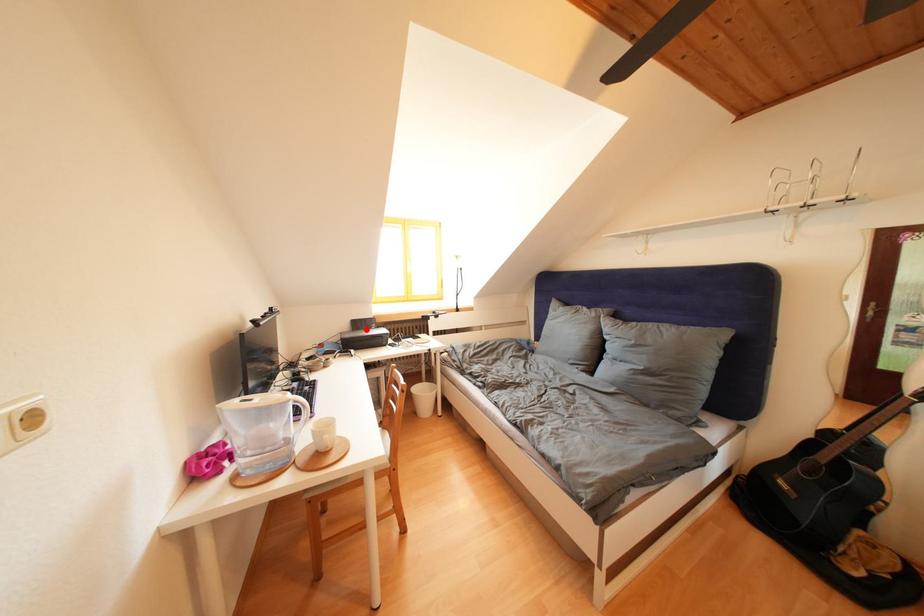
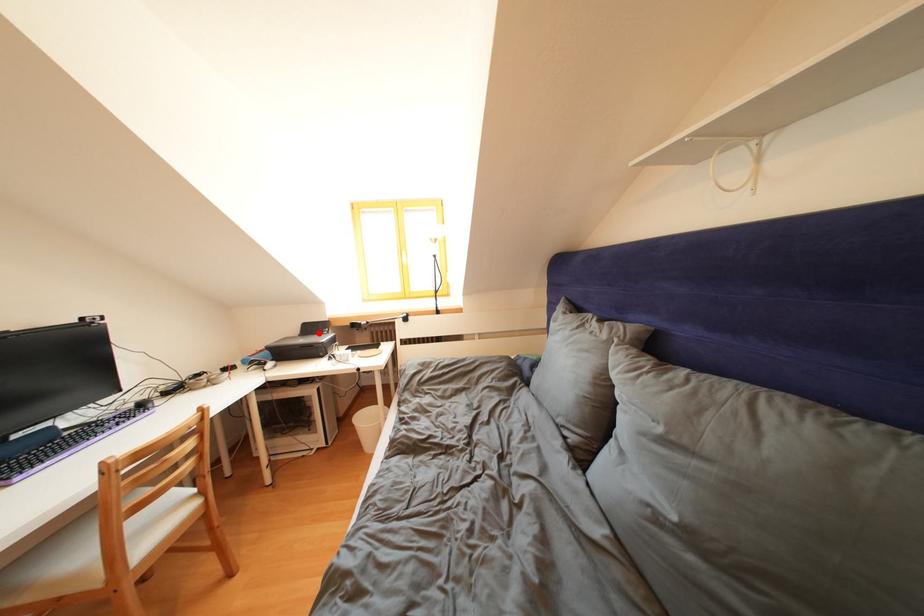
I am providing you with two images of the same scene from different viewpoints. A red point is marked on the first image and another point is marked on the second image. Are the points marked in image1 and image2 representing the same 3D position?

Yes